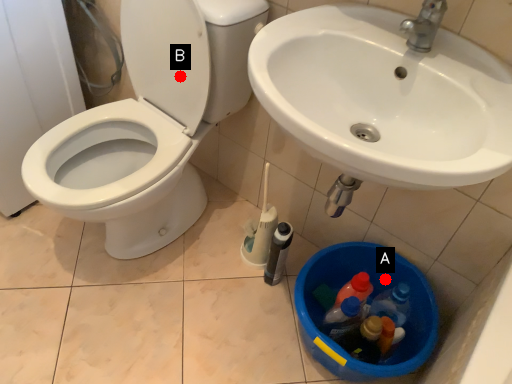
Question: Two points are circled on the image, labeled by A and B beside each circle. Which of the following is the closest to the observer?

Choices:
 (A) A is closer
 (B) B is closer

Answer: (B)